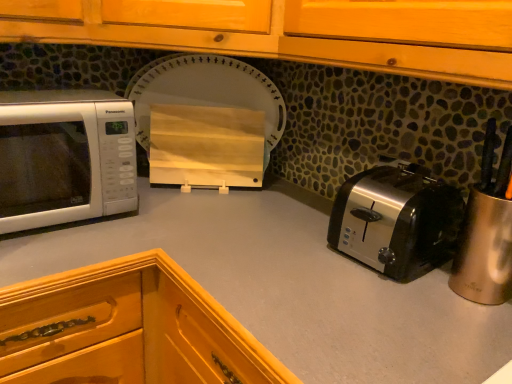
Question: Considering the relative sizes of smooth gray countertop at center and white glossy microwave at left in the image provided, is smooth gray countertop at center wider than white glossy microwave at left?

Choices:
 (A) yes
 (B) no

Answer: (A)

Question: Is smooth gray countertop at center thinner than white glossy microwave at left?

Choices:
 (A) no
 (B) yes

Answer: (A)

Question: From the image's perspective, is smooth gray countertop at center below white glossy microwave at left?

Choices:
 (A) yes
 (B) no

Answer: (A)

Question: From a real-world perspective, is smooth gray countertop at center located higher than white glossy microwave at left?

Choices:
 (A) yes
 (B) no

Answer: (B)

Question: Is smooth gray countertop at center at the right side of white glossy microwave at left?

Choices:
 (A) no
 (B) yes

Answer: (B)

Question: Do you think wooden cutting board at center is within smooth gray countertop at center, or outside of it?

Choices:
 (A) outside
 (B) inside

Answer: (A)

Question: Based on their sizes in the image, would you say wooden cutting board at center is bigger or smaller than smooth gray countertop at center?

Choices:
 (A) big
 (B) small

Answer: (B)

Question: Visually, is wooden cutting board at center positioned to the left or to the right of smooth gray countertop at center?

Choices:
 (A) left
 (B) right

Answer: (B)

Question: From a real-world perspective, is wooden cutting board at center positioned above or below smooth gray countertop at center?

Choices:
 (A) below
 (B) above

Answer: (B)

Question: Is smooth gray countertop at center in front of or behind wooden cutting board at center in the image?

Choices:
 (A) front
 (B) behind

Answer: (A)

Question: Choose the correct answer: Is smooth gray countertop at center inside wooden cutting board at center or outside it?

Choices:
 (A) inside
 (B) outside

Answer: (B)

Question: From a real-world perspective, is smooth gray countertop at center positioned above or below wooden cutting board at center?

Choices:
 (A) above
 (B) below

Answer: (B)

Question: Is smooth gray countertop at center to the left or to the right of wooden cutting board at center in the image?

Choices:
 (A) right
 (B) left

Answer: (B)

Question: From the image's perspective, relative to smooth gray countertop at center, is satin silver toaster at lower right above or below?

Choices:
 (A) below
 (B) above

Answer: (B)

Question: Considering the positions of point (414, 256) and point (373, 301), is point (414, 256) closer or farther from the camera than point (373, 301)?

Choices:
 (A) farther
 (B) closer

Answer: (A)